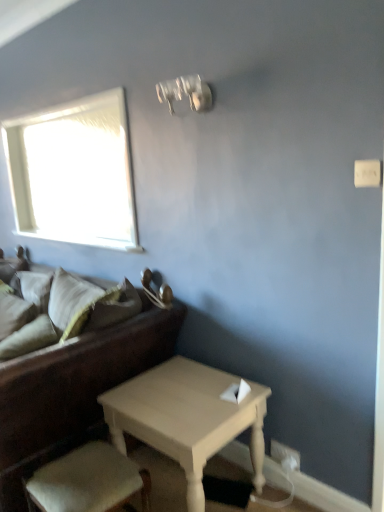
At what (x,y) coordinates should I click in order to perform the action: click on free space above light wood table at center (from a real-world perspective). Please return your answer as a coordinate pair (x, y). The height and width of the screenshot is (512, 384). Looking at the image, I should click on (180, 392).